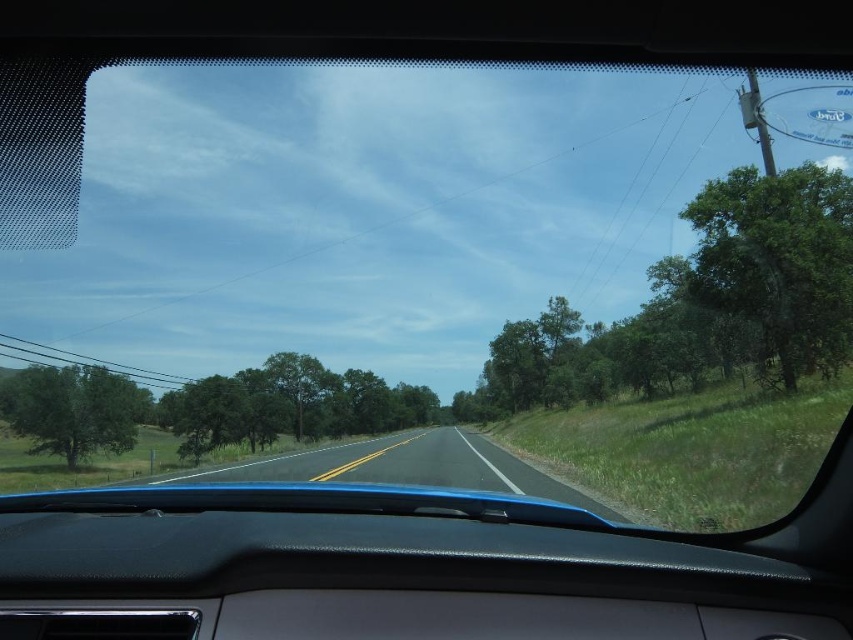
How much distance is there between green leafy tree at right and asphalt road at center?

584.48 feet

Is green leafy tree at right above asphalt road at center?

Indeed, green leafy tree at right is positioned over asphalt road at center.

Which is in front, point (752, 186) or point (320, 467)?

Point (752, 186)

Locate an element on the screen. This screenshot has height=640, width=853. green leafy tree at right is located at coordinates (778, 266).

Does point (848, 227) lie in front of point (132, 438)?

Yes, it is.

You are a GUI agent. You are given a task and a screenshot of the screen. Output one action in this format:
    pyautogui.click(x=<x>, y=<y>)
    Task: Click on the green leafy tree at right
    Image resolution: width=853 pixels, height=640 pixels.
    Given the screenshot: What is the action you would take?
    pyautogui.click(x=778, y=266)

Locate an element on the screen. The height and width of the screenshot is (640, 853). green leafy tree at right is located at coordinates (778, 266).

How far apart are asphalt road at center and green leafy tree at left?

asphalt road at center is 150.28 meters from green leafy tree at left.

Between asphalt road at center and green leafy tree at left, which one has more height?

green leafy tree at left is taller.

Between point (416, 477) and point (18, 412), which one is positioned in front?

Point (416, 477) is more forward.

Identify the location of asphalt road at center. (405, 467).